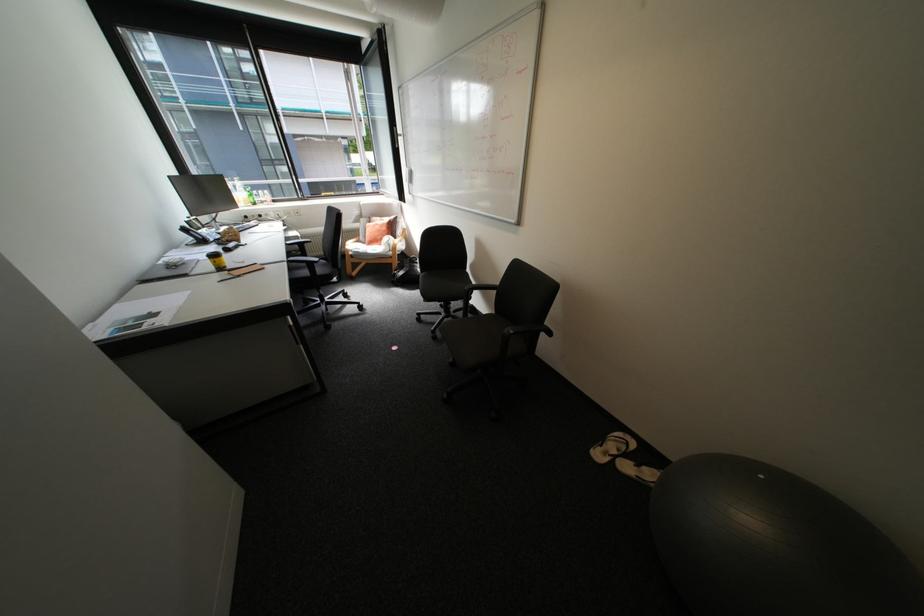
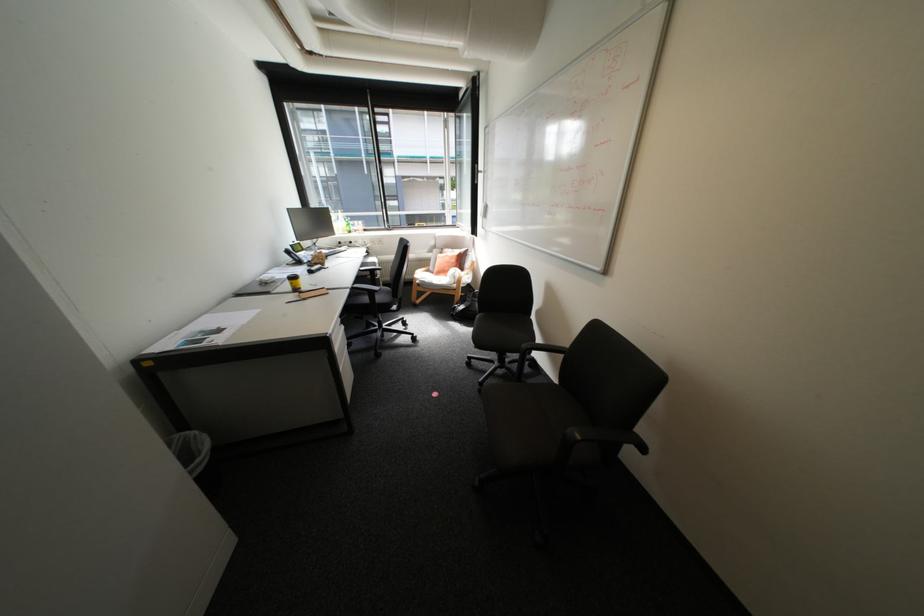
Find the pixel in the second image that matches [295,259] in the first image.

(359, 286)